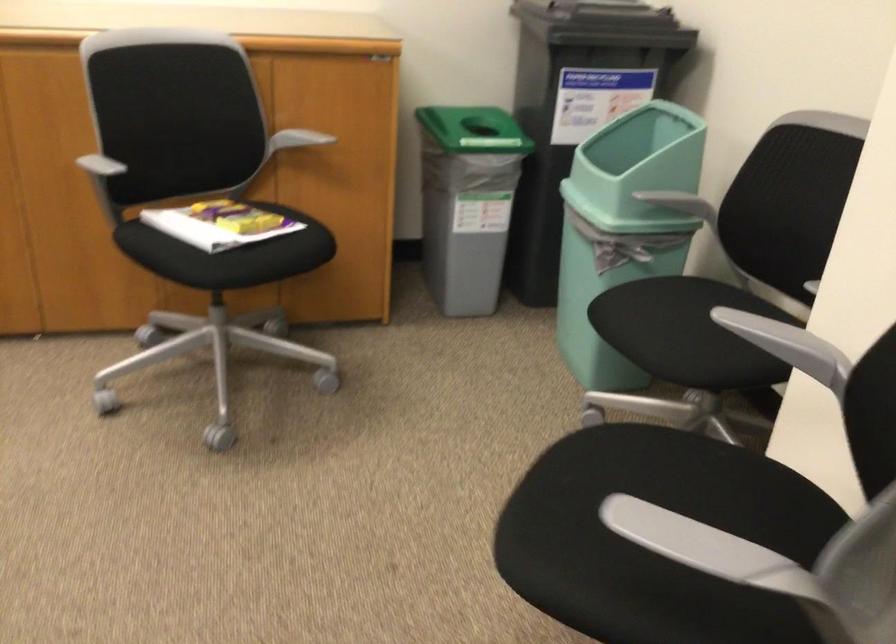
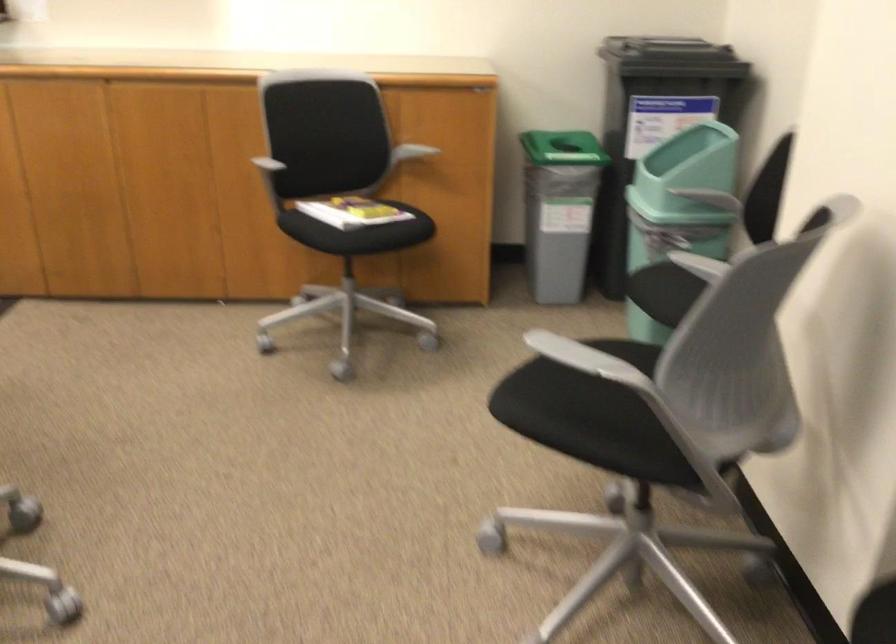
The point at (229, 225) is marked in the first image. Where is the corresponding point in the second image?

(355, 212)